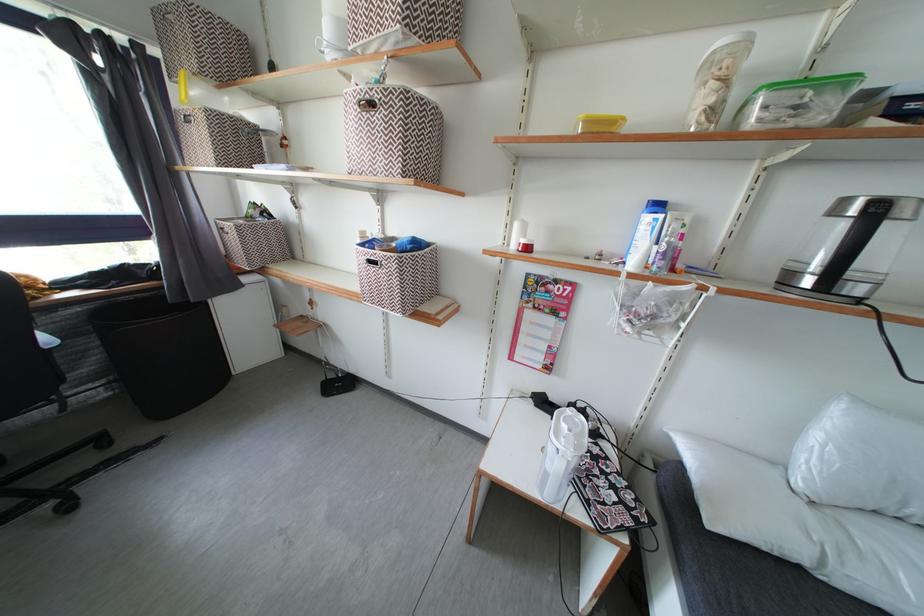
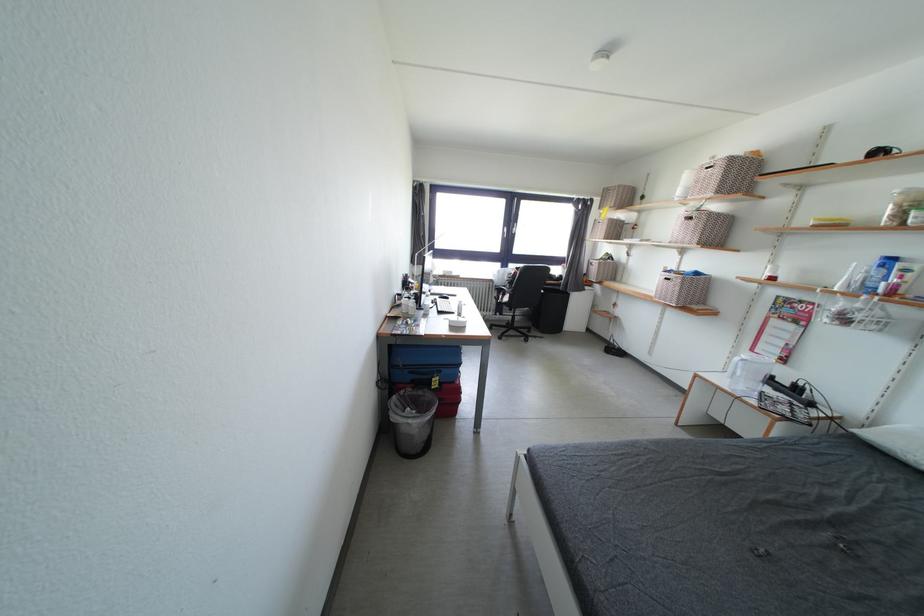
Locate, in the second image, the point that corresponds to point 517,362 in the first image.

(759, 355)